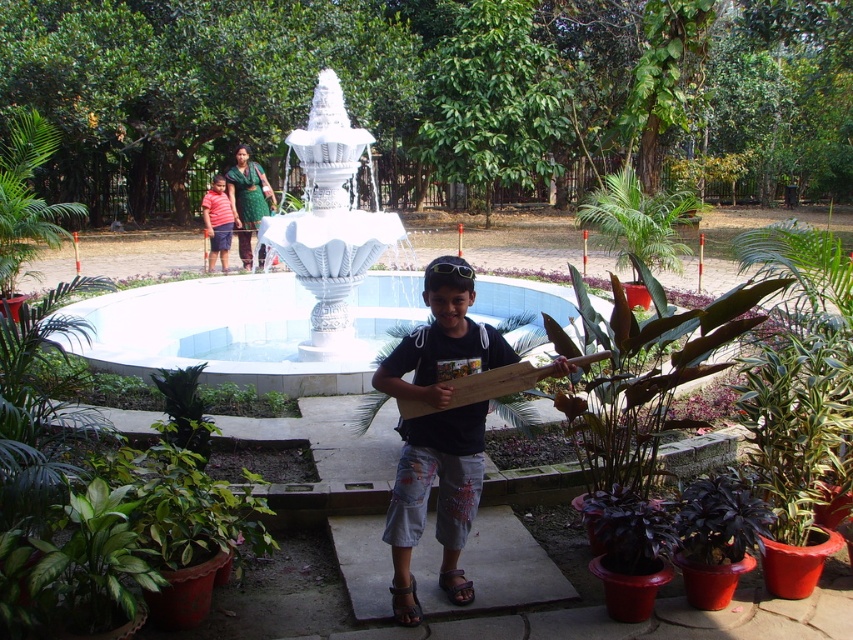
Can you confirm if white glossy fountain at center is positioned above dark blue t-shirt at center?

Yes, white glossy fountain at center is above dark blue t-shirt at center.

Can you confirm if white glossy fountain at center is smaller than dark blue t-shirt at center?

No.

Between point (317, 285) and point (462, 346), which one is positioned behind?

Positioned behind is point (317, 285).

Locate an element on the screen. The width and height of the screenshot is (853, 640). white glossy fountain at center is located at coordinates (276, 285).

Which of these two, dark blue t-shirt at center or striped cotton shirt at left, stands shorter?

With less height is striped cotton shirt at left.

Which of these two, dark blue t-shirt at center or striped cotton shirt at left, stands taller?

With more height is dark blue t-shirt at center.

At what (x,y) coordinates should I click in order to perform the action: click on dark blue t-shirt at center. Please return your answer as a coordinate pair (x, y). Image resolution: width=853 pixels, height=640 pixels. Looking at the image, I should click on (436, 500).

Can you confirm if white glossy fountain at center is positioned above striped cotton shirt at left?

Correct, white glossy fountain at center is located above striped cotton shirt at left.

Who is shorter, white glossy fountain at center or striped cotton shirt at left?

With less height is striped cotton shirt at left.

Looking at this image, measure the distance between white glossy fountain at center and camera.

They are 24.17 feet apart.

Find the location of a particular element. white glossy fountain at center is located at coordinates (276, 285).